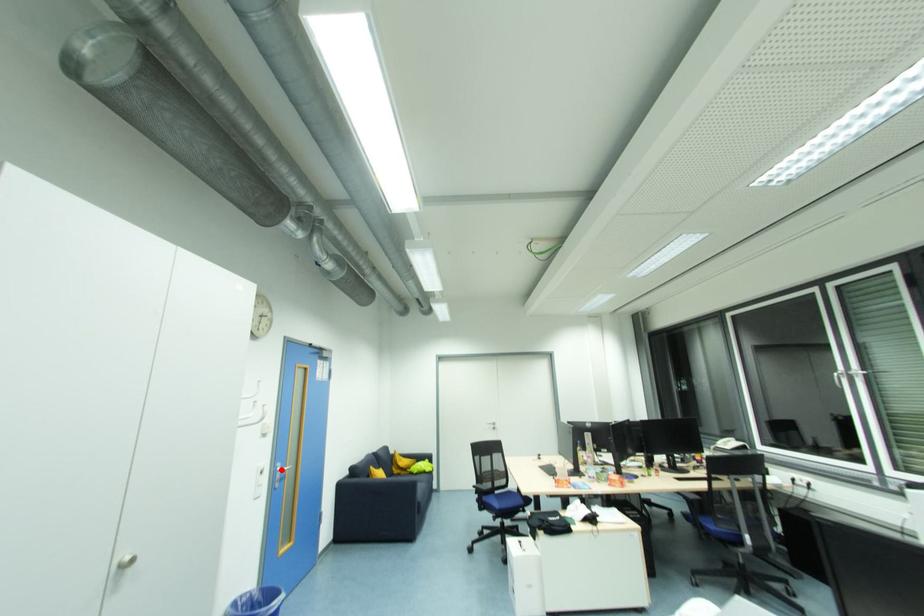
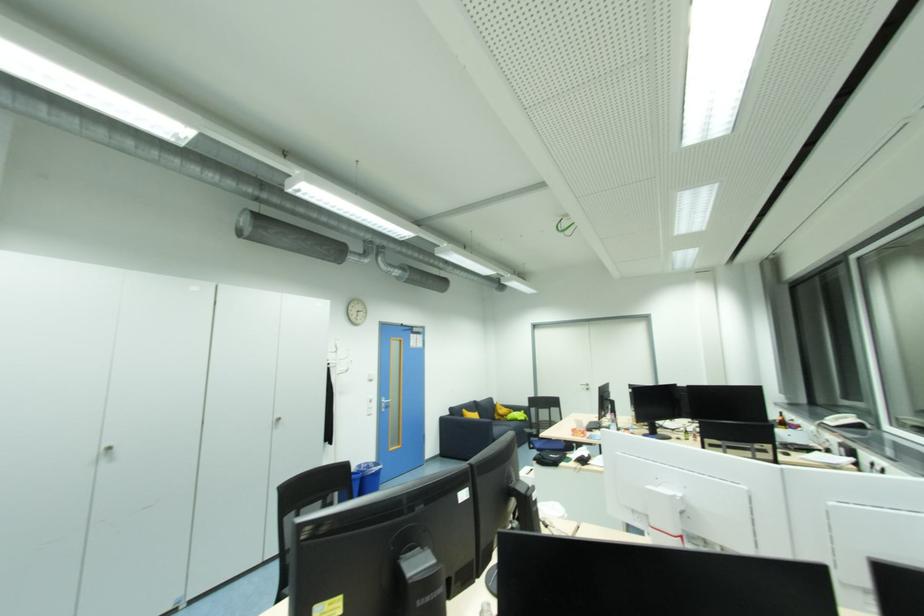
In the second image, find the point that corresponds to the highlighted location in the first image.

(386, 402)